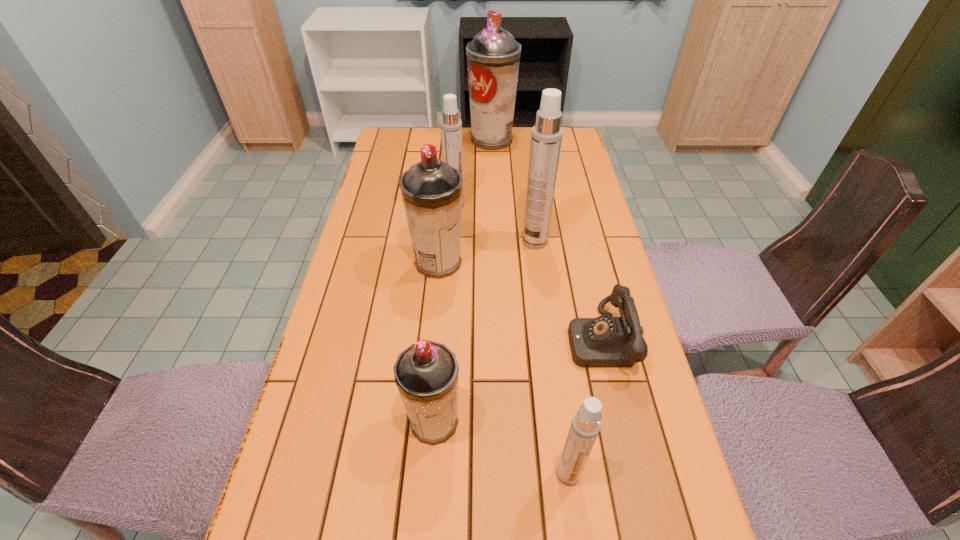
Where is `gray aerosol can that is the closest to the biggest white aerosol can`? The width and height of the screenshot is (960, 540). gray aerosol can that is the closest to the biggest white aerosol can is located at coordinates (431, 189).

Locate an element on the screen. The width and height of the screenshot is (960, 540). the second closest white aerosol can relative to the biggest white aerosol can is located at coordinates (585, 425).

You are a GUI agent. You are given a task and a screenshot of the screen. Output one action in this format:
    pyautogui.click(x=<x>, y=<y>)
    Task: Click on the white aerosol can object that ranks as the closest to the second nearest gray aerosol can
    This screenshot has height=540, width=960.
    Given the screenshot: What is the action you would take?
    pyautogui.click(x=451, y=126)